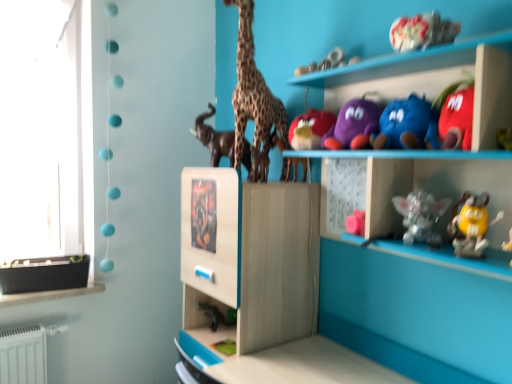
Question: Which direction should I rotate to face purple plush toy at upper center, marked as the 3th toy in a top-to-bottom arrangement, — up or down?

Choices:
 (A) down
 (B) up

Answer: (B)

Question: Which direction should I rotate to face purple plush toy at upper center, which is the fifth toy from top to bottom, — up or down?

Choices:
 (A) down
 (B) up

Answer: (B)

Question: Does fluffy plush toy at upper center, the first toy in the top-to-bottom sequence, have a greater height compared to satin silver figurine at center-right, which is the sixth toy in top-to-bottom order?

Choices:
 (A) no
 (B) yes

Answer: (A)

Question: Can you confirm if fluffy plush toy at upper center, which ranks as the eighth toy in bottom-to-top order, is positioned to the left of satin silver figurine at center-right, the third toy positioned from the bottom?

Choices:
 (A) no
 (B) yes

Answer: (A)

Question: Considering the relative positions of fluffy plush toy at upper center, the first toy in the top-to-bottom sequence, and satin silver figurine at center-right, which is the sixth toy in top-to-bottom order, in the image provided, is fluffy plush toy at upper center, the first toy in the top-to-bottom sequence, in front of satin silver figurine at center-right, which is the sixth toy in top-to-bottom order,?

Choices:
 (A) no
 (B) yes

Answer: (B)

Question: Does fluffy plush toy at upper center, which ranks as the eighth toy in bottom-to-top order, have a lesser width compared to satin silver figurine at center-right, which is the sixth toy in top-to-bottom order?

Choices:
 (A) yes
 (B) no

Answer: (B)

Question: Is fluffy plush toy at upper center, which ranks as the eighth toy in bottom-to-top order, positioned with its back to satin silver figurine at center-right, the third toy positioned from the bottom?

Choices:
 (A) no
 (B) yes

Answer: (A)

Question: Are fluffy plush toy at upper center, which ranks as the eighth toy in bottom-to-top order, and satin silver figurine at center-right, the third toy positioned from the bottom, making contact?

Choices:
 (A) yes
 (B) no

Answer: (B)

Question: Is the surface of yellow rubber duck at lower right, which ranks as the second toy in bottom-to-top order, in direct contact with purple plush toy at upper center, marked as the 3th toy in a top-to-bottom arrangement?

Choices:
 (A) yes
 (B) no

Answer: (B)

Question: Does yellow rubber duck at lower right, which ranks as the second toy in bottom-to-top order, have a larger size compared to purple plush toy at upper center, acting as the sixth toy starting from the bottom?

Choices:
 (A) yes
 (B) no

Answer: (B)

Question: Is yellow rubber duck at lower right, which appears as the seventh toy when viewed from the top, at the right side of purple plush toy at upper center, marked as the 3th toy in a top-to-bottom arrangement?

Choices:
 (A) no
 (B) yes

Answer: (B)

Question: Considering the relative sizes of yellow rubber duck at lower right, which appears as the seventh toy when viewed from the top, and purple plush toy at upper center, marked as the 3th toy in a top-to-bottom arrangement, in the image provided, is yellow rubber duck at lower right, which appears as the seventh toy when viewed from the top, wider than purple plush toy at upper center, marked as the 3th toy in a top-to-bottom arrangement,?

Choices:
 (A) no
 (B) yes

Answer: (A)

Question: From the image's perspective, is yellow rubber duck at lower right, which ranks as the second toy in bottom-to-top order, under purple plush toy at upper center, acting as the sixth toy starting from the bottom?

Choices:
 (A) no
 (B) yes

Answer: (B)

Question: Is yellow rubber duck at lower right, which ranks as the second toy in bottom-to-top order, outside purple plush toy at upper center, marked as the 3th toy in a top-to-bottom arrangement?

Choices:
 (A) yes
 (B) no

Answer: (A)

Question: Is satin silver figurine at center-right, which is the sixth toy in top-to-bottom order, not near yellow rubber duck at lower right, which appears as the seventh toy when viewed from the top?

Choices:
 (A) yes
 (B) no

Answer: (B)